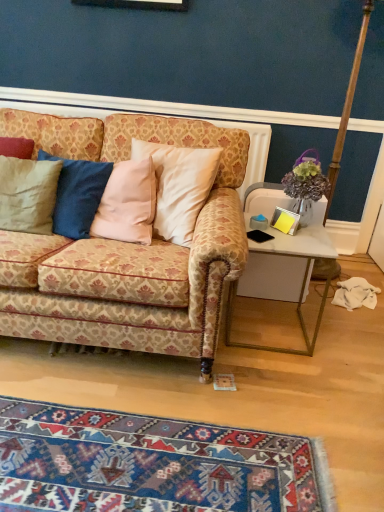
Locate an element on the screen. The width and height of the screenshot is (384, 512). blank area beneath white glossy desk at right (from a real-world perspective) is located at coordinates (263, 326).